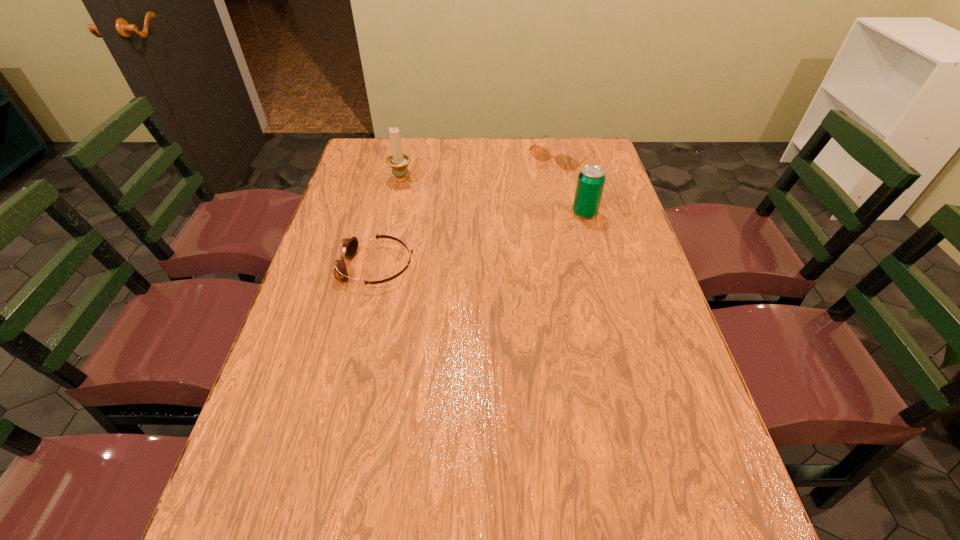
Find the location of a particular element. This screenshot has width=960, height=540. vacant space on the desktop that is between the nearest object and the beer can and is positioned on the face of the sunglasses is located at coordinates (462, 245).

In order to click on free space on the desktop that is between the goggles and the beer can and is positioned on the handle side of the candle_holder in this screenshot , I will do 483,239.